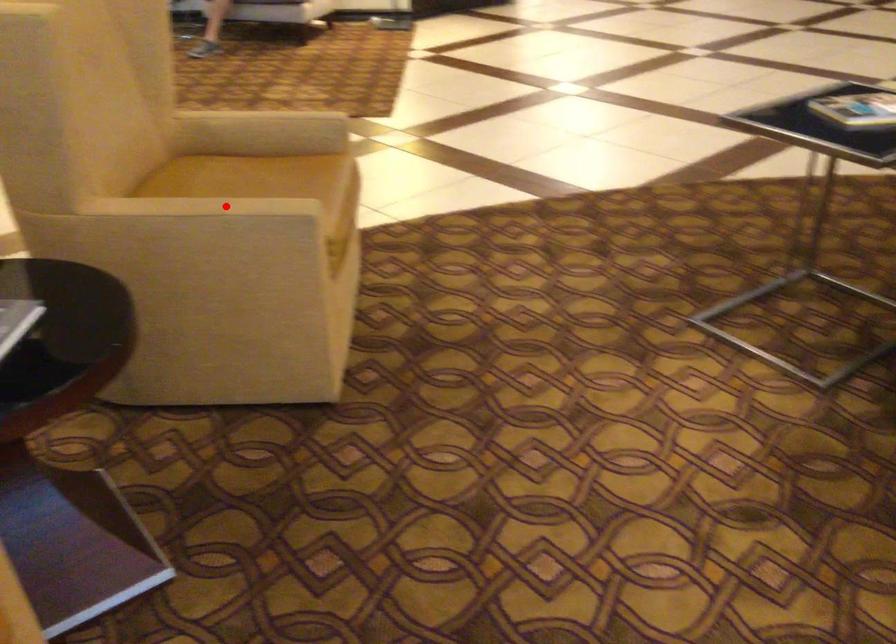
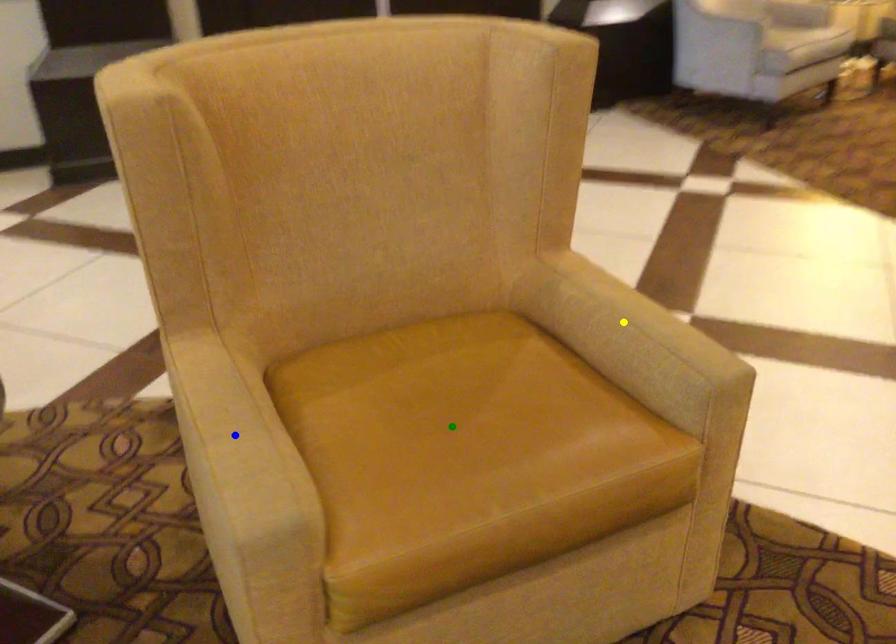
Question: I am providing you with two images of the same scene from different viewpoints. A red point is marked on the first image. You are given multiple points on the second image. Which point in image 2 represents the same 3d spot as the red point in image 1?

Choices:
 (A) green point
 (B) yellow point
 (C) blue point

Answer: (C)